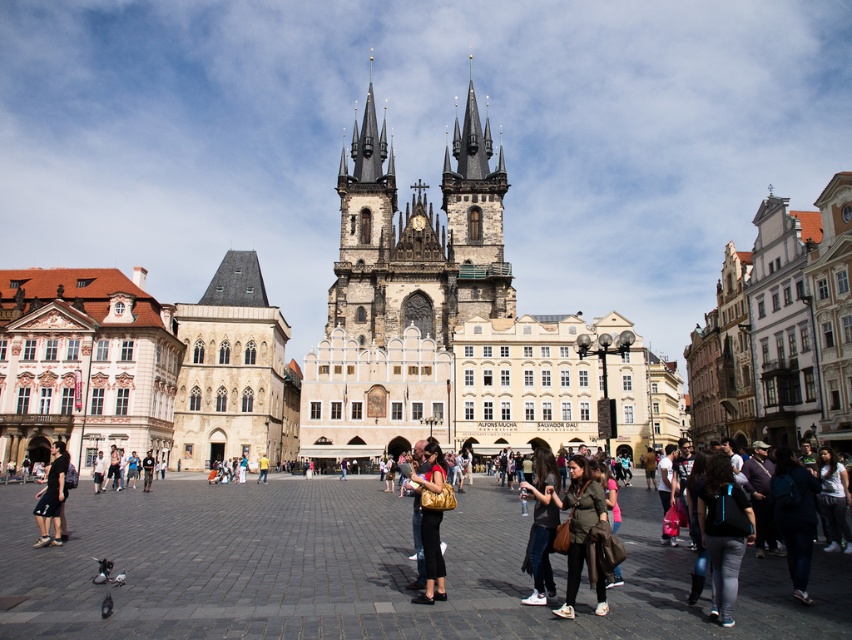
You are standing in the square in front of the stone gothic church at center. If you face directly towards the church, which direction should you walk to reach the point marked at coordinates 0.492 on the x axis and 0.516 on the y axis?

The stone gothic church at center is already located at the coordinates 0.492 on the x axis and 0.516 on the y axis, so you are already facing the correct direction. Simply walk straight towards the church to reach the point.

You are a photographer standing in the square in front of the cathedral. You notice two jackets in the scene. The dark gray fabric jacket at center and the denim jacket at lower right. Which jacket is positioned higher in the image?

The dark gray fabric jacket at center is positioned higher in the image than the denim jacket at lower right.